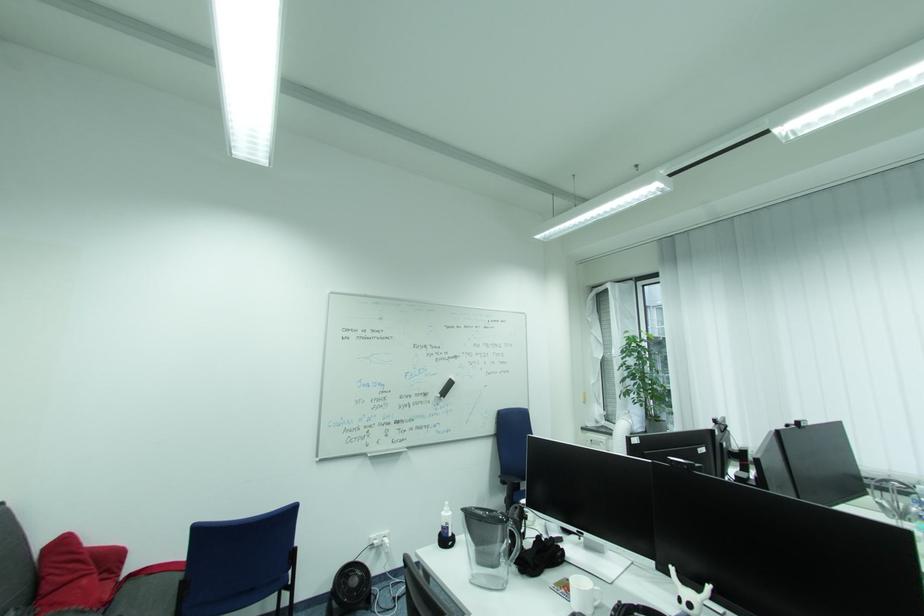
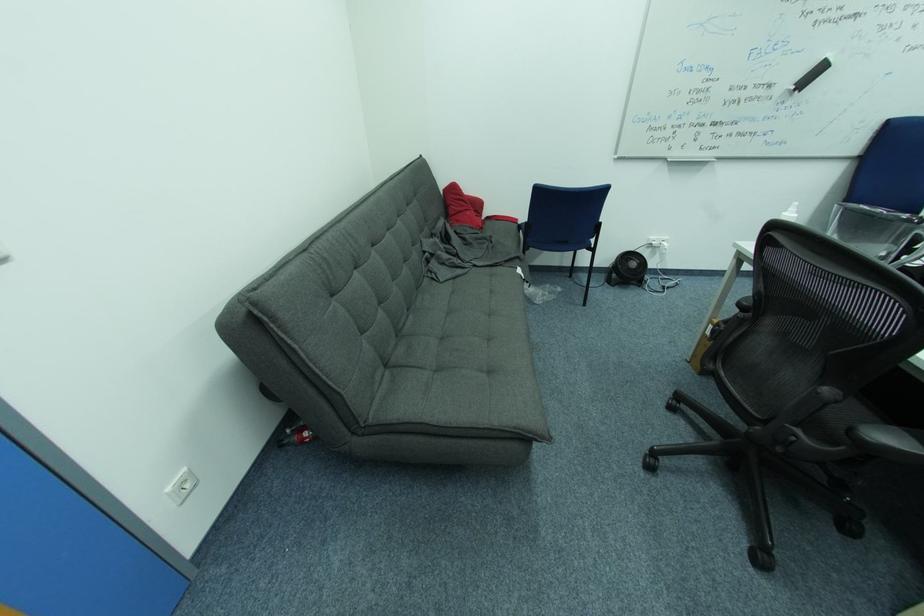
Find the pixel in the second image that matches point (450, 515) in the first image.

(792, 215)